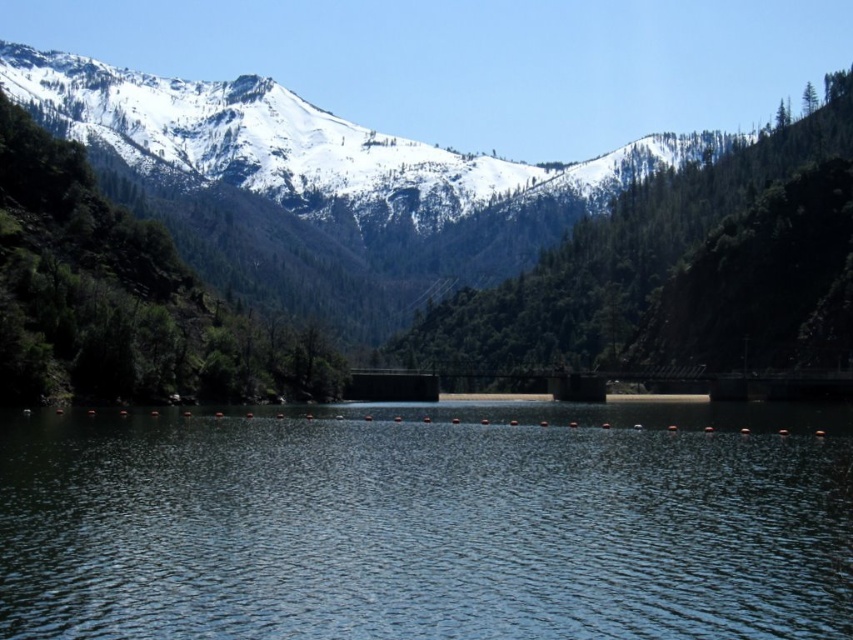
Does clear blue water at center have a larger size compared to green textured tree at upper center?

No.

Locate an element on the screen. clear blue water at center is located at coordinates (428, 524).